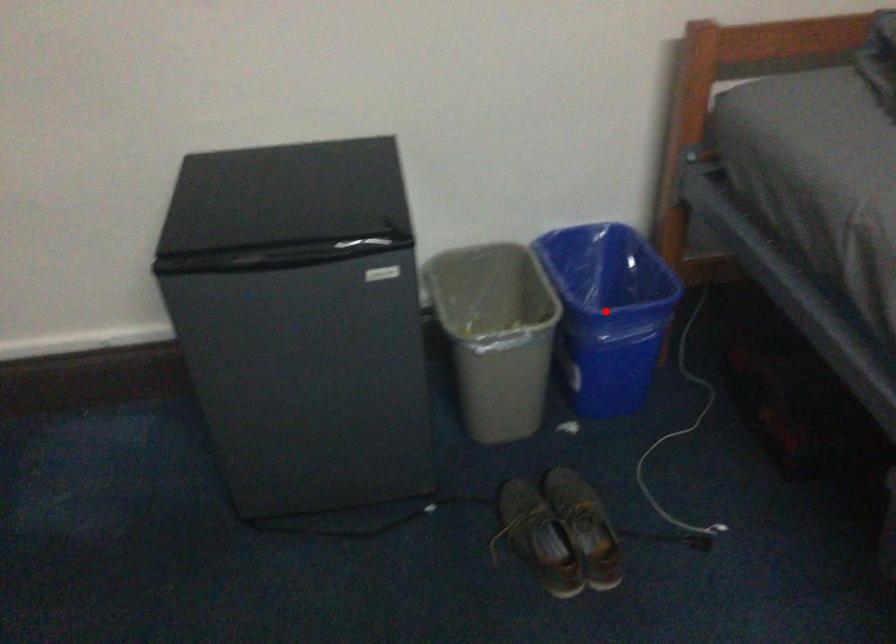
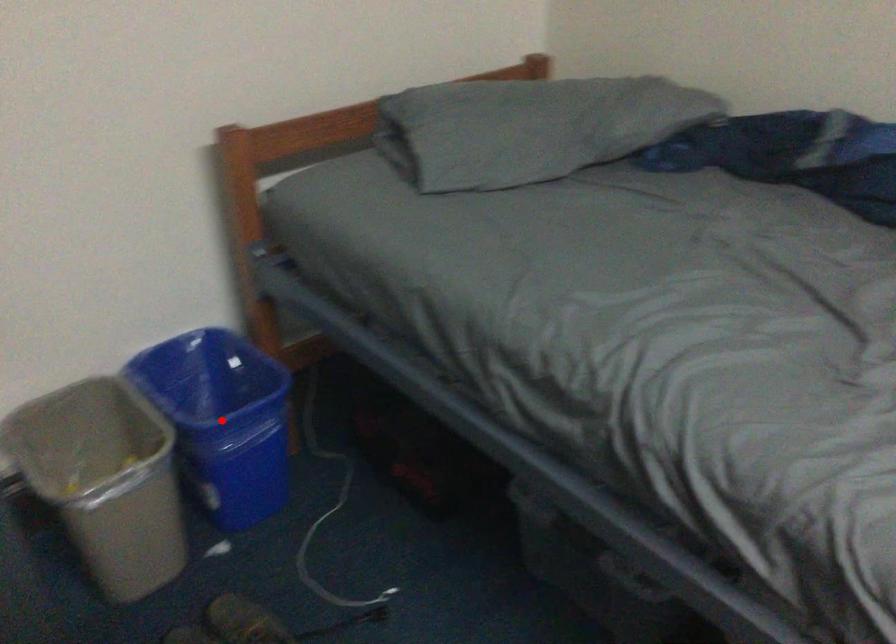
I am providing you with two images of the same scene from different viewpoints. A red point is marked on the first image and another point is marked on the second image. Does the point marked in image1 correspond to the same location as the one in image2?

Yes